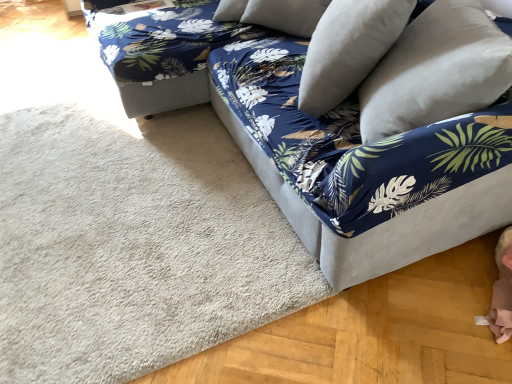
Question: Is velvet blue couch at center oriented away from white soft pillow at upper right, marked as the 1th pillow in a left-to-right arrangement?

Choices:
 (A) yes
 (B) no

Answer: (A)

Question: Is velvet blue couch at center closer to the viewer compared to white soft pillow at upper right, the second pillow positioned from the right?

Choices:
 (A) yes
 (B) no

Answer: (A)

Question: Is velvet blue couch at center thinner than white soft pillow at upper right, the second pillow positioned from the right?

Choices:
 (A) yes
 (B) no

Answer: (B)

Question: Is velvet blue couch at center not near white soft pillow at upper right, marked as the 1th pillow in a left-to-right arrangement?

Choices:
 (A) yes
 (B) no

Answer: (B)

Question: Does velvet blue couch at center have a greater height compared to white soft pillow at upper right, the second pillow positioned from the right?

Choices:
 (A) yes
 (B) no

Answer: (A)

Question: Is white soft pillow at upper right, the second pillow positioned from the right, a part of velvet blue couch at center?

Choices:
 (A) no
 (B) yes

Answer: (B)

Question: Is velvety white pillow at upper right, which ranks as the second pillow in left-to-right order, aimed at blue floral fabric bean bag at upper right?

Choices:
 (A) yes
 (B) no

Answer: (B)

Question: Is the depth of velvety white pillow at upper right, which ranks as the second pillow in left-to-right order, less than that of blue floral fabric bean bag at upper right?

Choices:
 (A) yes
 (B) no

Answer: (A)

Question: Is the position of velvety white pillow at upper right, which ranks as the second pillow in left-to-right order, more distant than that of blue floral fabric bean bag at upper right?

Choices:
 (A) no
 (B) yes

Answer: (A)

Question: From a real-world perspective, is velvety white pillow at upper right, which ranks as the second pillow in left-to-right order, on blue floral fabric bean bag at upper right?

Choices:
 (A) yes
 (B) no

Answer: (A)

Question: Can you confirm if velvety white pillow at upper right, the first pillow viewed from the right, is taller than blue floral fabric bean bag at upper right?

Choices:
 (A) yes
 (B) no

Answer: (B)

Question: From the image's perspective, would you say velvety white pillow at upper right, the first pillow viewed from the right, is positioned over blue floral fabric bean bag at upper right?

Choices:
 (A) no
 (B) yes

Answer: (A)

Question: Does velvet blue couch at center have a larger size compared to beige carpet at lower left?

Choices:
 (A) yes
 (B) no

Answer: (A)